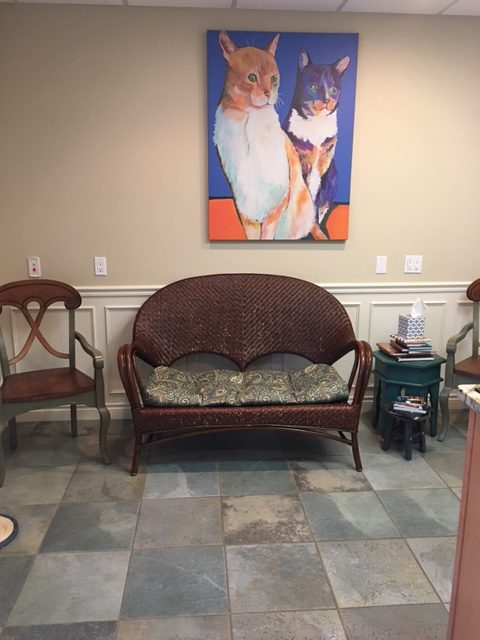
The width and height of the screenshot is (480, 640). In order to click on tissue box in this screenshot , I will do pyautogui.click(x=415, y=326).